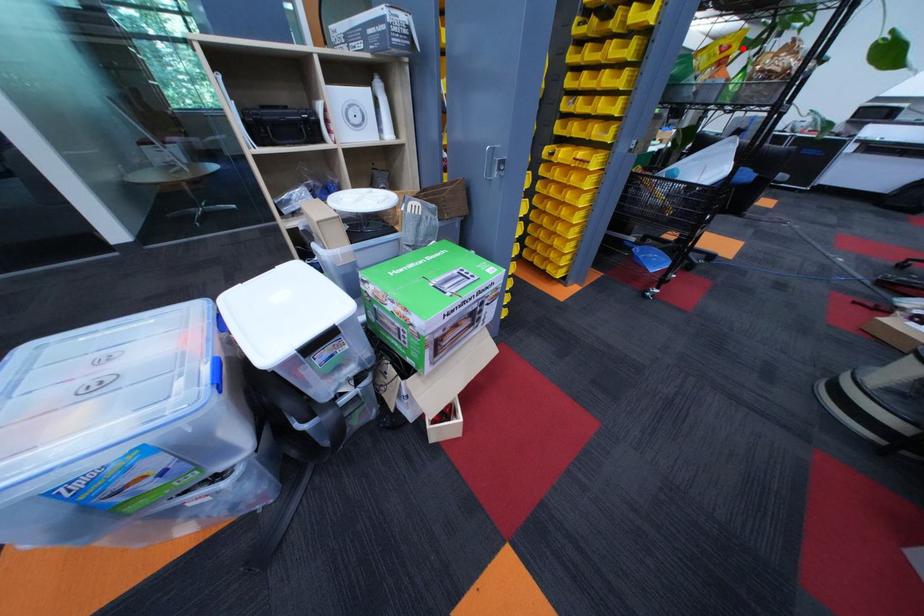
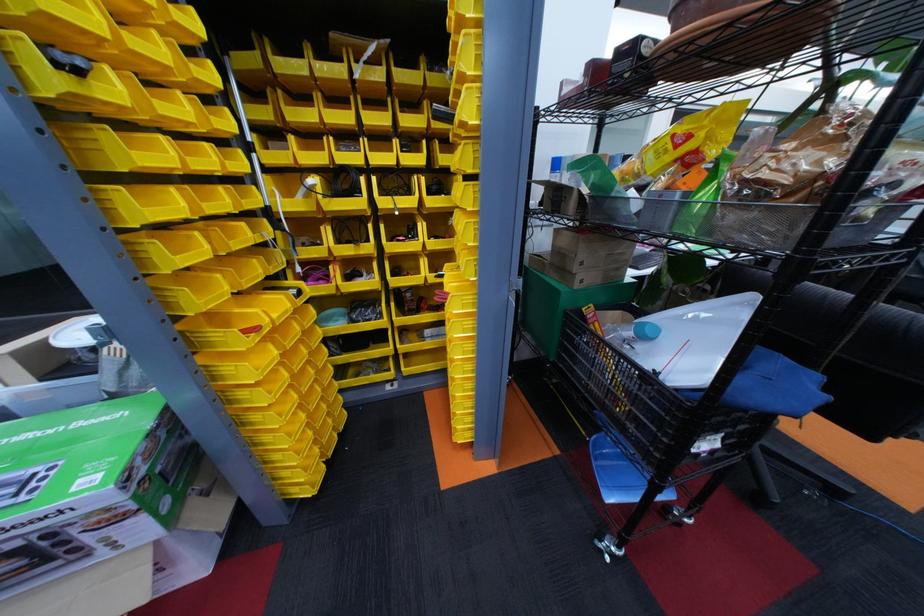
In the second image, find the point that corresponds to the highlighted location in the first image.

(702, 138)